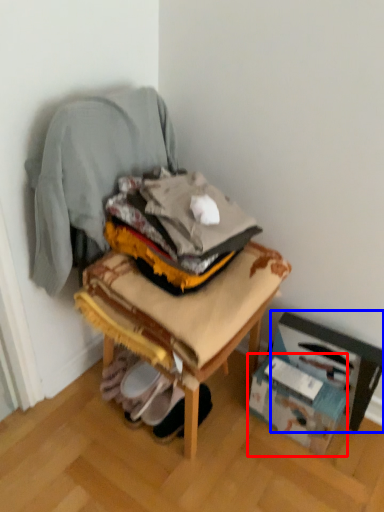
Question: Which of the following is the closest to the observer, cardboard box (highlighted by a red box) or cardboard box (highlighted by a blue box)?

Choices:
 (A) cardboard box
 (B) cardboard box

Answer: (B)